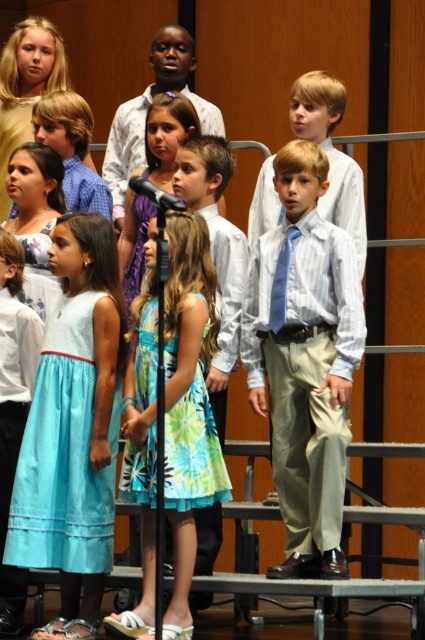
Question: Does light blue striped shirt at center appear on the right side of black plastic microphone at center?

Choices:
 (A) no
 (B) yes

Answer: (B)

Question: Can you confirm if blue satin tie at center is positioned to the left of black plastic microphone at center?

Choices:
 (A) no
 (B) yes

Answer: (A)

Question: Is blue satin tie at center closer to the viewer compared to black plastic microphone at center?

Choices:
 (A) no
 (B) yes

Answer: (A)

Question: Which is nearer to the light blue dress at center?

Choices:
 (A) blue satin tie at center
 (B) black plastic microphone at center

Answer: (A)

Question: Which object appears closest to the camera in this image?

Choices:
 (A) light blue striped shirt at center
 (B) light blue dress at center
 (C) blue satin tie at center
 (D) black plastic microphone at center

Answer: (D)

Question: Estimate the real-world distances between objects in this image. Which object is farther from the light blue striped shirt at center?

Choices:
 (A) black plastic microphone at center
 (B) blue satin tie at center
 (C) light blue dress at center

Answer: (C)